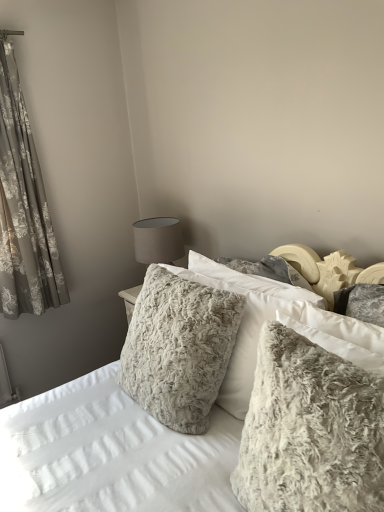
Question: From the image's perspective, is fuzzy white pillow at center, the 2th pillow from the front, on top of fuzzy gray pillow at center?

Choices:
 (A) yes
 (B) no

Answer: (A)

Question: Could fuzzy gray pillow at center be considered to be inside fuzzy white pillow at center, the first pillow when ordered from back to front?

Choices:
 (A) yes
 (B) no

Answer: (B)

Question: Considering the relative sizes of fuzzy white pillow at center, the first pillow when ordered from back to front, and fuzzy gray pillow at center in the image provided, is fuzzy white pillow at center, the first pillow when ordered from back to front, thinner than fuzzy gray pillow at center?

Choices:
 (A) no
 (B) yes

Answer: (B)

Question: Is fuzzy white pillow at center, the first pillow when ordered from back to front, looking in the opposite direction of fuzzy gray pillow at center?

Choices:
 (A) yes
 (B) no

Answer: (A)

Question: Are fuzzy white pillow at center, the first pillow when ordered from back to front, and fuzzy gray pillow at center located far from each other?

Choices:
 (A) yes
 (B) no

Answer: (B)

Question: Is fuzzy white pillow at center, the 2th pillow from the front, further to the viewer compared to fuzzy gray pillow at center?

Choices:
 (A) no
 (B) yes

Answer: (B)

Question: Is floral-patterned fabric at left at the back of fuzzy gray pillow at center?

Choices:
 (A) no
 (B) yes

Answer: (A)

Question: Is fuzzy gray pillow at center next to floral-patterned fabric at left and touching it?

Choices:
 (A) yes
 (B) no

Answer: (B)

Question: Does fuzzy gray pillow at center lie behind floral-patterned fabric at left?

Choices:
 (A) yes
 (B) no

Answer: (B)

Question: Can you confirm if fuzzy gray pillow at center is bigger than floral-patterned fabric at left?

Choices:
 (A) no
 (B) yes

Answer: (B)

Question: Is fuzzy gray pillow at center at the right side of floral-patterned fabric at left?

Choices:
 (A) yes
 (B) no

Answer: (A)

Question: Does fuzzy gray pillow at center appear on the left side of floral-patterned fabric at left?

Choices:
 (A) no
 (B) yes

Answer: (A)

Question: From a real-world perspective, is floral-patterned fabric at left positioned under fuzzy white pillow at center, the first pillow when ordered from back to front, based on gravity?

Choices:
 (A) no
 (B) yes

Answer: (A)